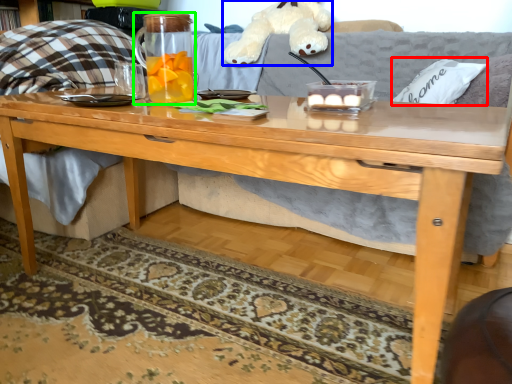
Question: Which object is positioned farthest from pillow (highlighted by a red box)? Select from toy (highlighted by a blue box) and beverage (highlighted by a green box).

Choices:
 (A) toy
 (B) beverage

Answer: (B)